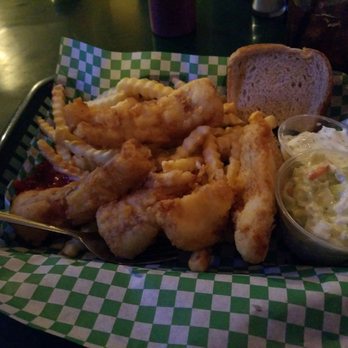
Identify the location of silverware. This screenshot has width=348, height=348. (59, 230).